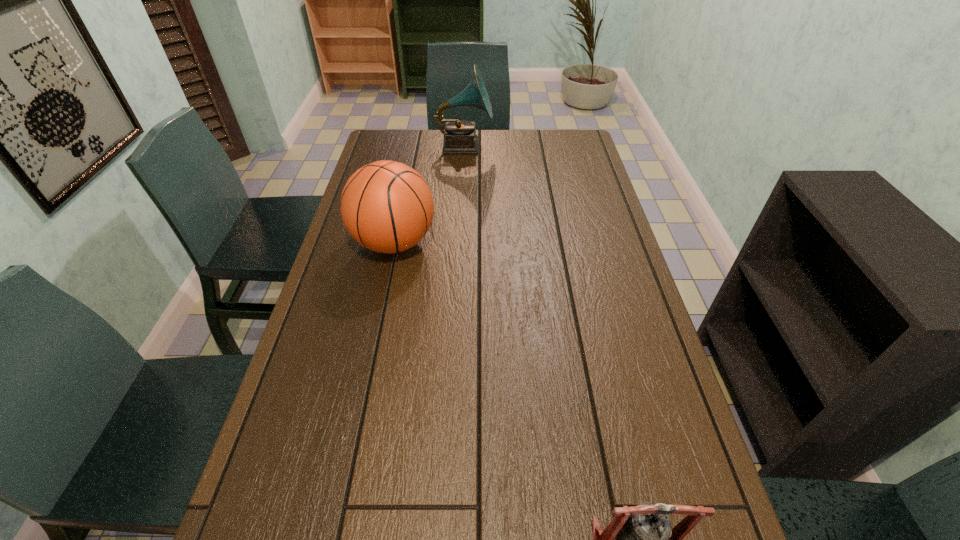
The image size is (960, 540). Find the location of `vacant space at the far left corner of the desktop`. vacant space at the far left corner of the desktop is located at coordinates (384, 131).

The height and width of the screenshot is (540, 960). I want to click on object that can be found as the second closest to the rightmost object, so click(460, 137).

Select which object appears as the closest to the bell. Please provide its 2D coordinates. Your answer should be formatted as a tuple, i.e. [(x, y)], where the tuple contains the x and y coordinates of a point satisfying the conditions above.

[(386, 206)]